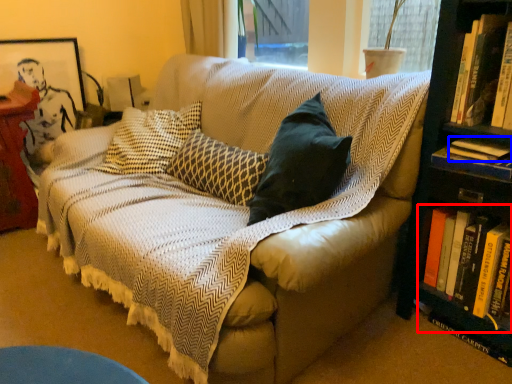
Question: Which object appears farthest to the camera in this image, book (highlighted by a red box) or book (highlighted by a blue box)?

Choices:
 (A) book
 (B) book

Answer: (B)